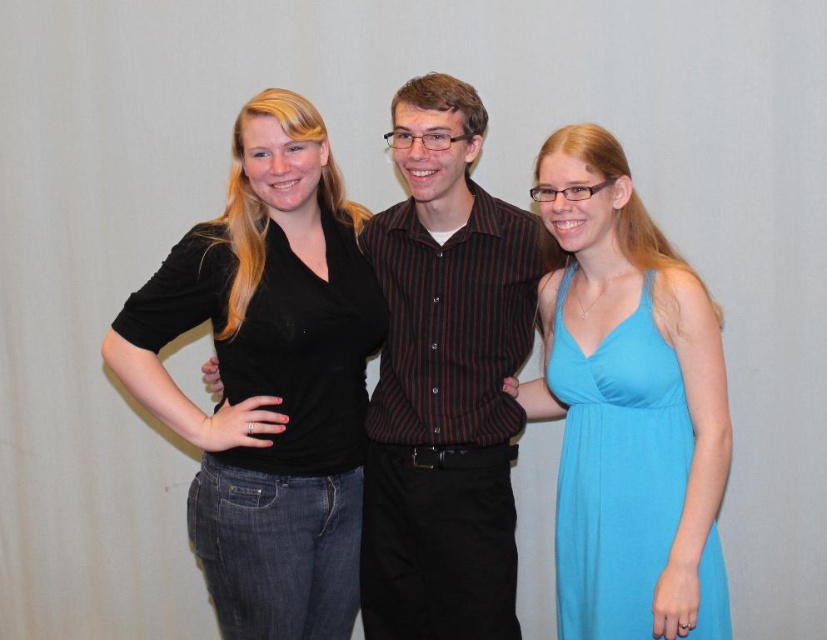
You are a photographer setting up a photo shoot. You need to ensure that the black cotton shirt at center and the striped cotton shirt at center are visible in the final image. Based on their positions, which shirt will appear lower in the frame?

The black cotton shirt at center is positioned under the striped cotton shirt at center, so it will appear lower in the frame.

You are a photographer trying to capture a group photo of the striped cotton shirt at center and the matte blue dress at right. Since you want to ensure both subjects are in focus, you need to know their relative positions. Which object is located to the left of the other?

The striped cotton shirt at center is positioned on the left side of matte blue dress at right.